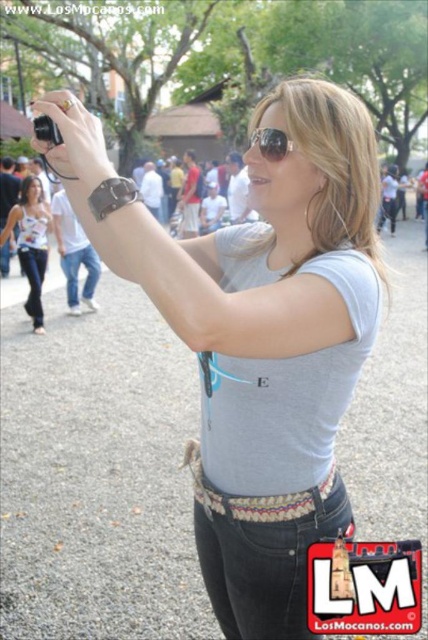
Is white printed tank top at center bigger than matte black camera at upper left?

Actually, white printed tank top at center might be smaller than matte black camera at upper left.

Which is in front, point (36, 298) or point (58, 102)?

Point (58, 102) is in front.

Between point (32, 285) and point (39, 140), which one is positioned in front?

Point (39, 140) is in front.

Identify the location of white printed tank top at center. (30, 243).

Is point (208, 557) in front of point (65, 280)?

Yes, it is.

Which is in front, point (273, 502) or point (74, 301)?

Positioned in front is point (273, 502).

The image size is (428, 640). Find the location of `jeans at center`. jeans at center is located at coordinates (262, 556).

Is jeans at center closer to camera compared to denim jeans at lower left?

Yes, it is.

Locate an element on the screen. The image size is (428, 640). jeans at center is located at coordinates (262, 556).

The width and height of the screenshot is (428, 640). Describe the element at coordinates (262, 556) in the screenshot. I see `jeans at center` at that location.

The height and width of the screenshot is (640, 428). I want to click on jeans at center, so click(x=262, y=556).